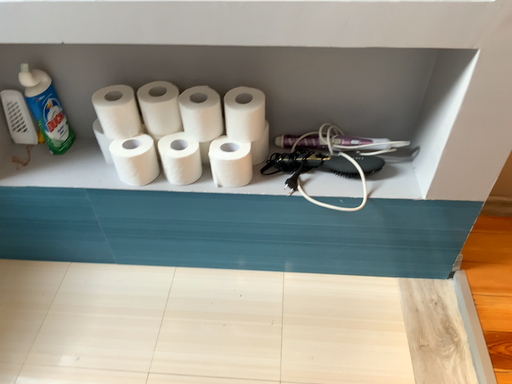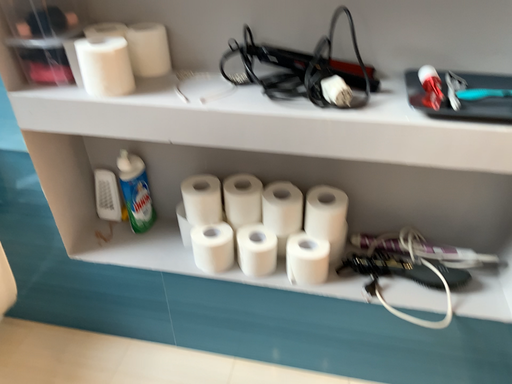
Question: How did the camera likely rotate when shooting the video?

Choices:
 (A) rotated upward
 (B) rotated downward

Answer: (A)